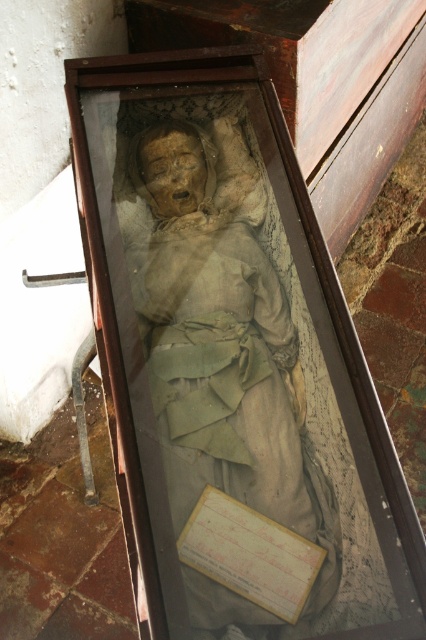
Does matte brown statue at center lie in front of yellow paper at center?

Yes, matte brown statue at center is in front of yellow paper at center.

Between matte brown statue at center and yellow paper at center, which one is positioned higher?

matte brown statue at center is higher up.

Is point (287, 408) behind point (308, 563)?

Yes.

Image resolution: width=426 pixels, height=640 pixels. Find the location of `matte brown statue at center`. matte brown statue at center is located at coordinates (221, 337).